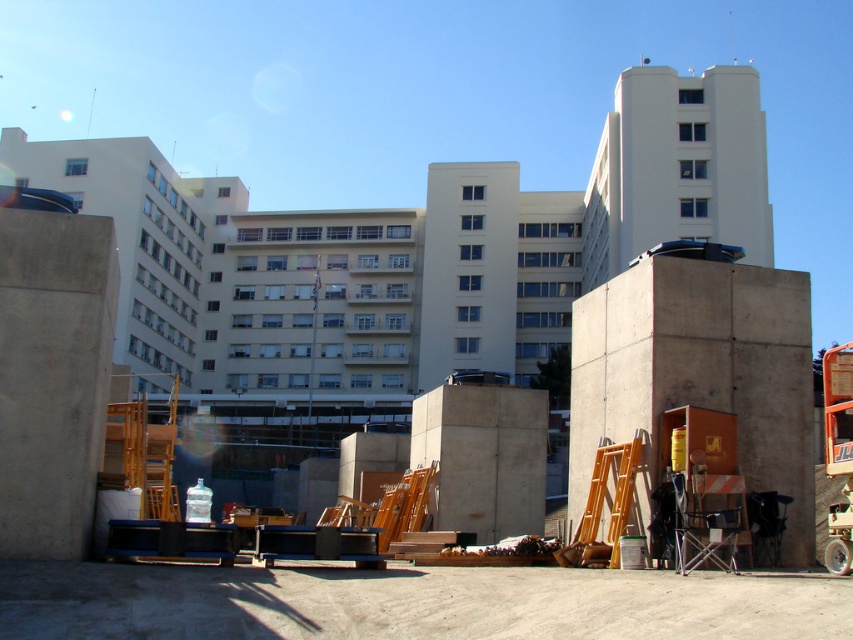
You are a construction worker standing at the entrance of the building. You need to retrieve the blue toolbox located near the yellow ladder. Which object, the concrete rough at lower center or the concreteroughblock at right, is closer to you as you move towards the toolbox?

The concrete rough at lower center is closer to you because it is in front of the concreteroughblock at right, so you would encounter it first on your way to the toolbox.

You are a construction worker standing at the entrance of the building. You need to move the blue toolbox from its current position to the concrete rough at lower center. However, there is a concreteroughblock at right in the way. Can you move the toolbox around the block to reach the destination?

The concrete rough at lower center is below the concreteroughblock at right, so the concreteroughblock at right is blocking the path. You need to move the toolbox around the block to reach the destination.